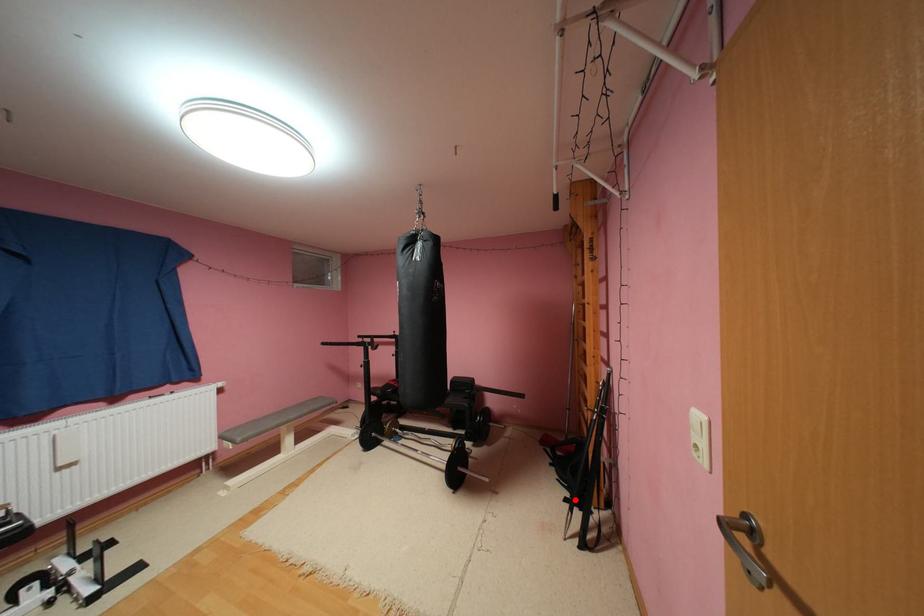
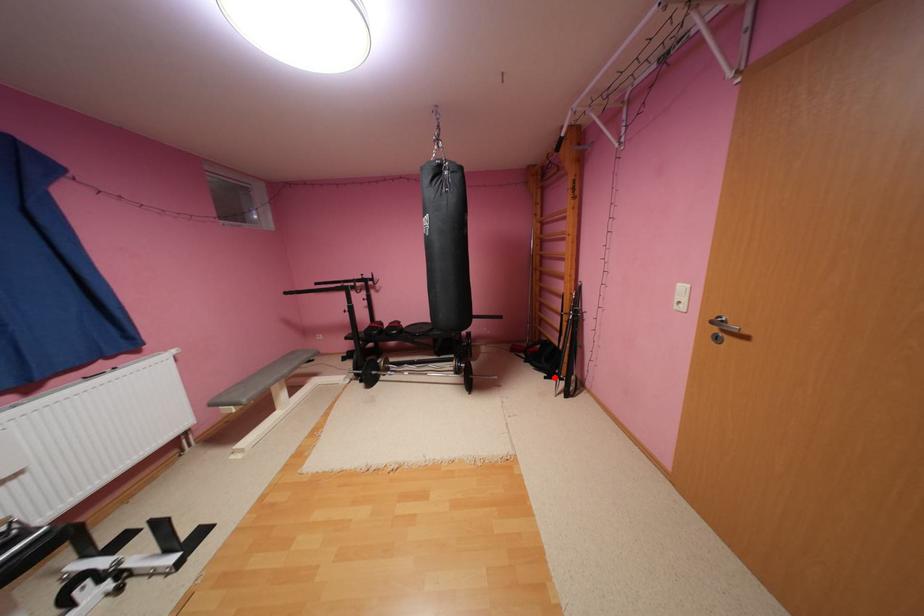
I am providing you with two images of the same scene from different viewpoints. A red point is marked on the first image and another point is marked on the second image. Is the marked point in image1 the same physical position as the marked point in image2?

Yes